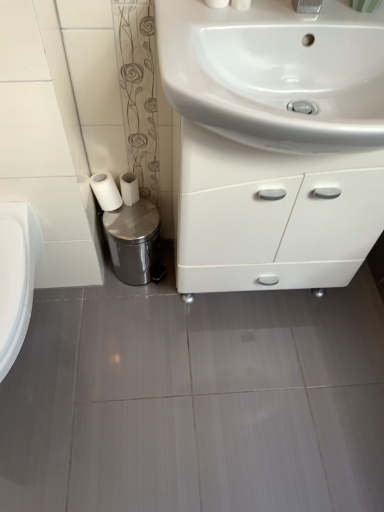
Question: Is the surface of shiny metallic trash can at lower left in direct contact with white matte toilet paper at lower left, the second toilet paper in the left-to-right sequence?

Choices:
 (A) no
 (B) yes

Answer: (A)

Question: Does shiny metallic trash can at lower left have a lesser height compared to white matte toilet paper at lower left, the second toilet paper in the left-to-right sequence?

Choices:
 (A) yes
 (B) no

Answer: (B)

Question: From the image's perspective, is shiny metallic trash can at lower left beneath white matte toilet paper at lower left, positioned as the first toilet paper in right-to-left order?

Choices:
 (A) yes
 (B) no

Answer: (A)

Question: From the image's perspective, is shiny metallic trash can at lower left over white matte toilet paper at lower left, the second toilet paper in the left-to-right sequence?

Choices:
 (A) no
 (B) yes

Answer: (A)

Question: Is shiny metallic trash can at lower left completely or partially outside of white matte toilet paper at lower left, the second toilet paper in the left-to-right sequence?

Choices:
 (A) yes
 (B) no

Answer: (A)

Question: From a real-world perspective, is shiny metallic trash can at lower left positioned under white matte toilet paper at lower left, positioned as the first toilet paper in right-to-left order, based on gravity?

Choices:
 (A) no
 (B) yes

Answer: (B)

Question: From a real-world perspective, does white glossy cabinet at center sit lower than white matte toilet paper at lower left, positioned as the first toilet paper in right-to-left order?

Choices:
 (A) no
 (B) yes

Answer: (A)

Question: Does white glossy cabinet at center have a greater width compared to white matte toilet paper at lower left, positioned as the first toilet paper in right-to-left order?

Choices:
 (A) yes
 (B) no

Answer: (A)

Question: From a real-world perspective, is white glossy cabinet at center physically above white matte toilet paper at lower left, positioned as the first toilet paper in right-to-left order?

Choices:
 (A) yes
 (B) no

Answer: (A)

Question: Can you confirm if white glossy cabinet at center is shorter than white matte toilet paper at lower left, the second toilet paper in the left-to-right sequence?

Choices:
 (A) no
 (B) yes

Answer: (A)

Question: Is white matte toilet paper at lower left, the second toilet paper in the left-to-right sequence, a part of white glossy cabinet at center?

Choices:
 (A) yes
 (B) no

Answer: (B)

Question: Is white glossy cabinet at center not inside white matte toilet paper at lower left, positioned as the first toilet paper in right-to-left order?

Choices:
 (A) yes
 (B) no

Answer: (A)

Question: Is white matte toilet paper at lower left, the second toilet paper from the right, behind white glossy sink at upper center?

Choices:
 (A) no
 (B) yes

Answer: (B)